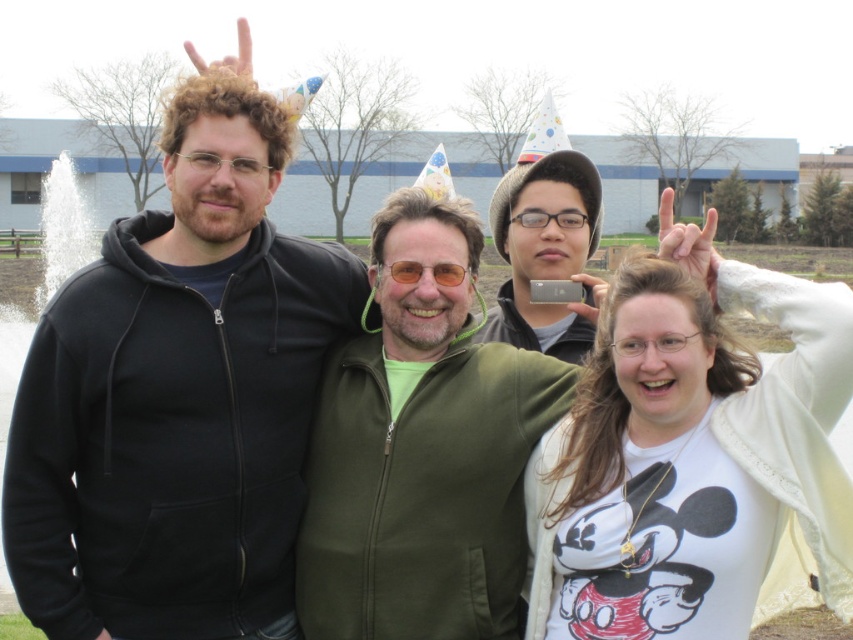
You are a photographer setting up for a group photo. You have a camera with a 30cm wide lens. The black fleece jacket at left and orange reflective glasses at center are in your frame. Which object will require more horizontal space in your camera frame?

The black fleece jacket at left requires more horizontal space in the camera frame because its width surpasses that of the orange reflective glasses at center.